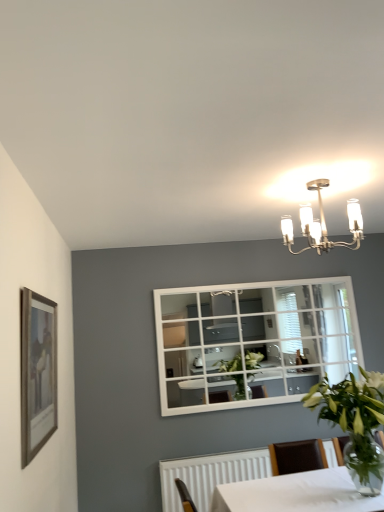
The width and height of the screenshot is (384, 512). Find the location of `free location above satin nickel chandelier at upper center (from a real-world perspective)`. free location above satin nickel chandelier at upper center (from a real-world perspective) is located at coordinates (347, 174).